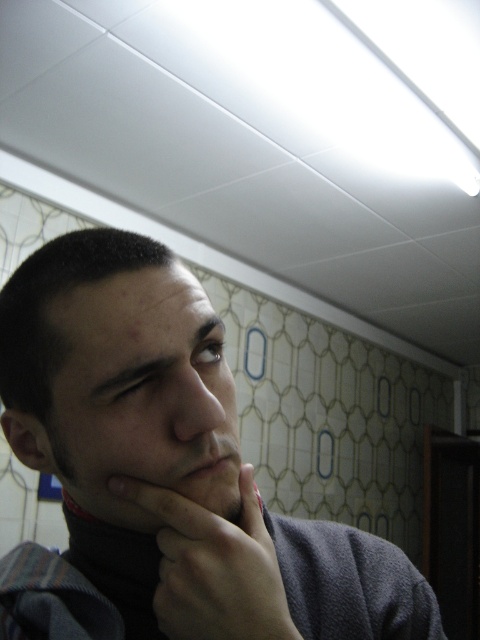
In the scene shown: You are a photographer setting up a shoot in the bathroom scene. You need to ensure that the smooth skin hand at center is visible beneath the matte skin at center. Based on their current positions, is this possible?

→ Yes, the smooth skin hand at center is positioned under matte skin at center, so it is naturally visible beneath it.